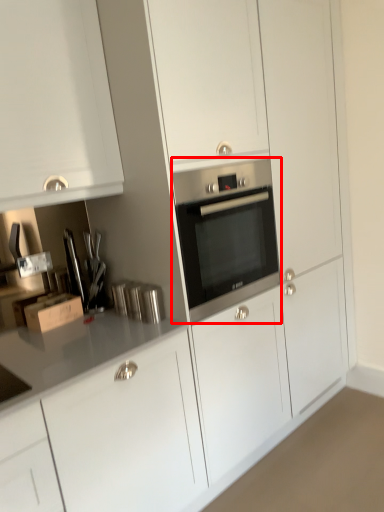
Question: Considering the relative positions of home appliance (annotated by the red box) and cardboard box in the image provided, where is home appliance (annotated by the red box) located with respect to the staircase?

Choices:
 (A) right
 (B) left

Answer: (A)